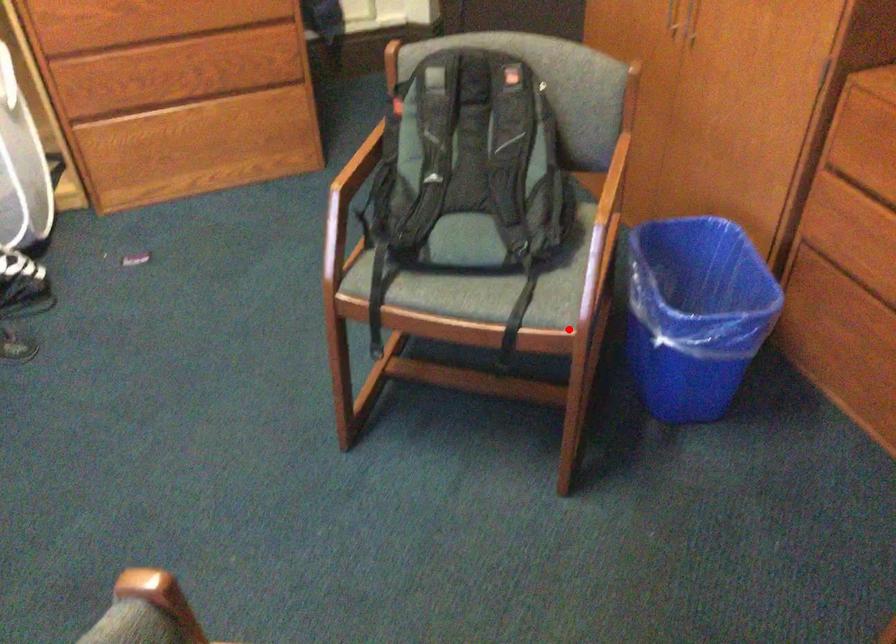
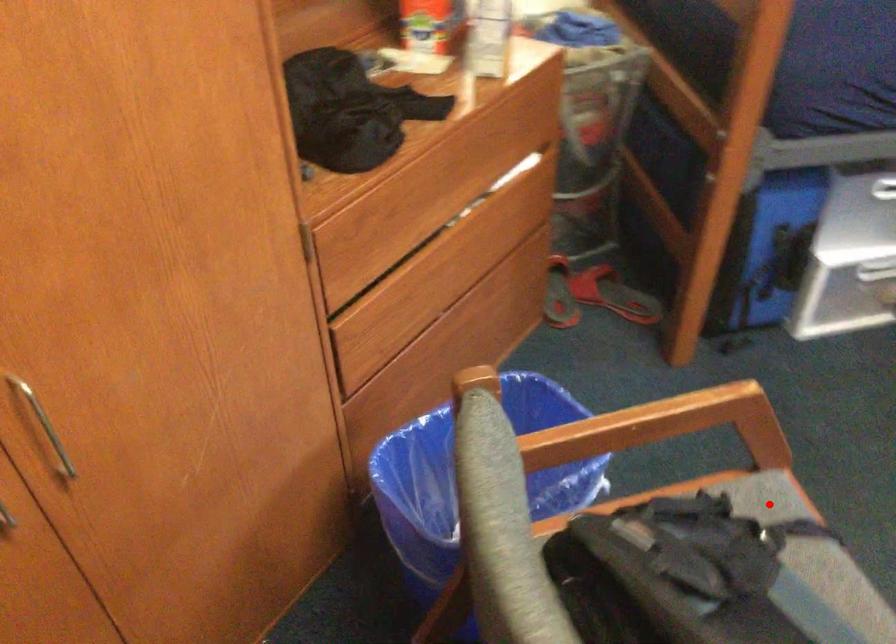
I am providing you with two images of the same scene from different viewpoints. A red point is marked on the first image and another point is marked on the second image. Is the red point in image1 aligned with the point shown in image2?

Yes